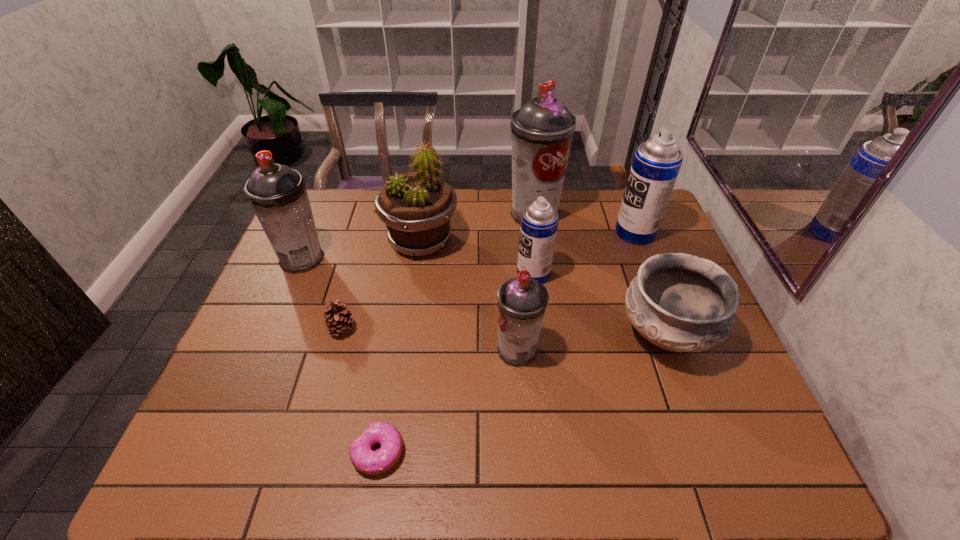
This screenshot has width=960, height=540. I want to click on vacant position located 0.050m on the front of the leftmost gray aerosol can, so click(290, 288).

Where is `free space located on the back of the flowerpot`? The height and width of the screenshot is (540, 960). free space located on the back of the flowerpot is located at coordinates (425, 209).

The height and width of the screenshot is (540, 960). What are the coordinates of `vacant space located on the label side of the left blue aerosol can` in the screenshot? It's located at (402, 274).

Where is `vacant region located 0.400m on the label side of the left blue aerosol can`? vacant region located 0.400m on the label side of the left blue aerosol can is located at coordinates (382, 274).

The width and height of the screenshot is (960, 540). Find the location of `free space located 0.210m on the label side of the left blue aerosol can`. free space located 0.210m on the label side of the left blue aerosol can is located at coordinates point(446,274).

Image resolution: width=960 pixels, height=540 pixels. Find the location of `free space located 0.060m on the left of the nearest aerosol can`. free space located 0.060m on the left of the nearest aerosol can is located at coordinates (471, 350).

Locate an element on the screen. vacant space positioned on the back of the seventh tallest object is located at coordinates (645, 281).

This screenshot has height=540, width=960. Identify the location of free location located 0.340m on the front of the second shortest object. pos(302,476).

The height and width of the screenshot is (540, 960). Identify the location of vacant region located 0.080m on the left of the nearest object. (314, 452).

Where is `flowerpot located in the far edge section of the desktop`? flowerpot located in the far edge section of the desktop is located at coordinates (416, 207).